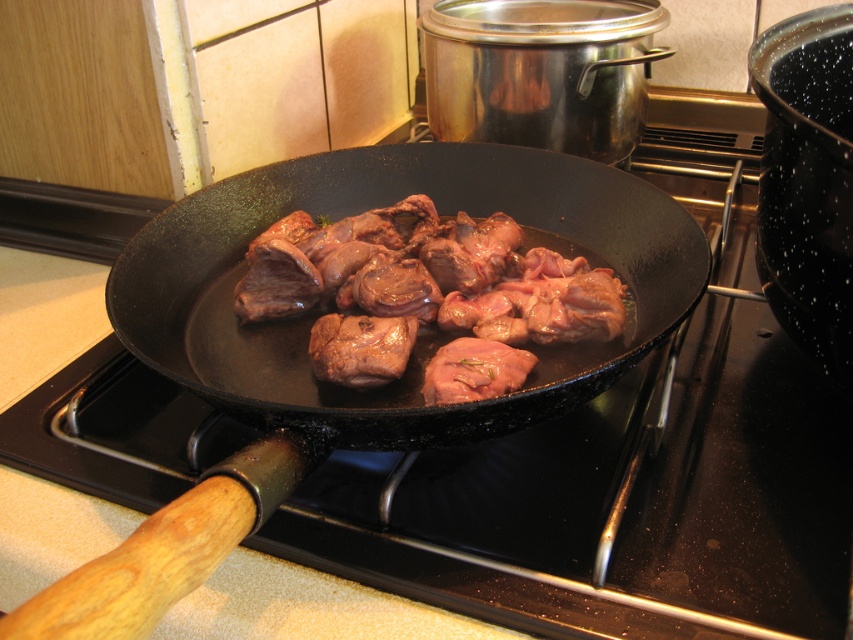
Question: Among these points, which one is nearest to the camera?

Choices:
 (A) (546, 369)
 (B) (364, 224)

Answer: (A)

Question: Does black matte wok at center have a smaller size compared to brown glossy meat at center?

Choices:
 (A) no
 (B) yes

Answer: (A)

Question: Among these points, which one is nearest to the camera?

Choices:
 (A) click(297, 170)
 (B) click(456, 284)

Answer: (B)

Question: Among these points, which one is nearest to the camera?

Choices:
 (A) (213, 212)
 (B) (491, 244)

Answer: (B)

Question: Can you confirm if black matte wok at center is positioned to the left of brown glossy meat at center?

Choices:
 (A) yes
 (B) no

Answer: (A)

Question: From the image, what is the correct spatial relationship of black matte wok at center in relation to brown glossy meat at center?

Choices:
 (A) above
 (B) below

Answer: (B)